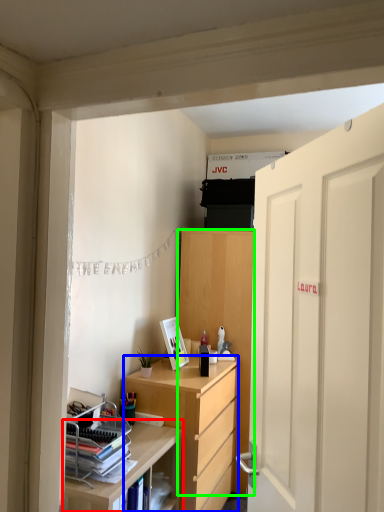
Question: Which is farther away from shelf (highlighted by a red box)? desk (highlighted by a blue box) or cabinetry (highlighted by a green box)?

Choices:
 (A) desk
 (B) cabinetry

Answer: (B)